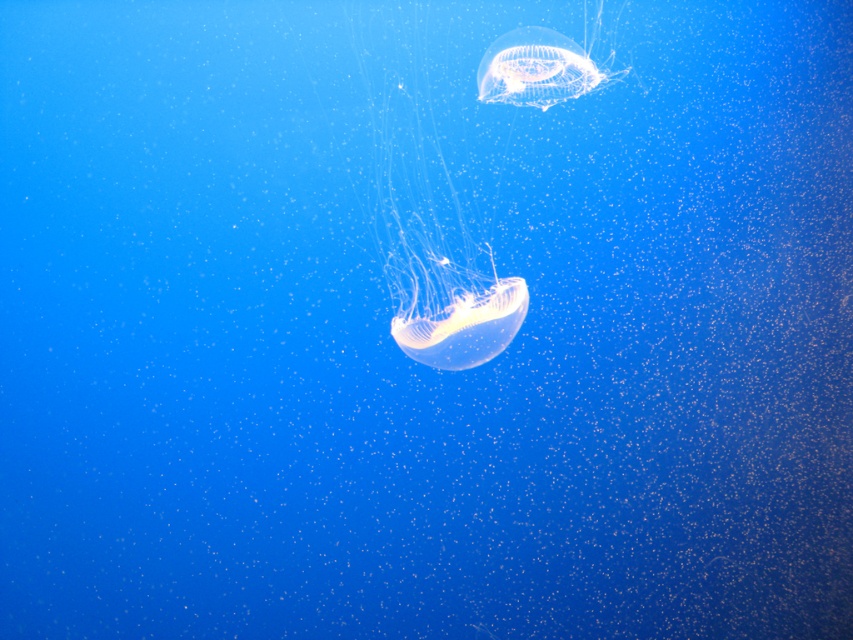
Can you confirm if translucent gelatinous at center is positioned below transparent gelatinous at upper center?

Yes, translucent gelatinous at center is below transparent gelatinous at upper center.

Which is in front, point (469, 145) or point (537, 38)?

Point (537, 38) is more forward.

Where is `translucent gelatinous at center`? translucent gelatinous at center is located at coordinates (428, 200).